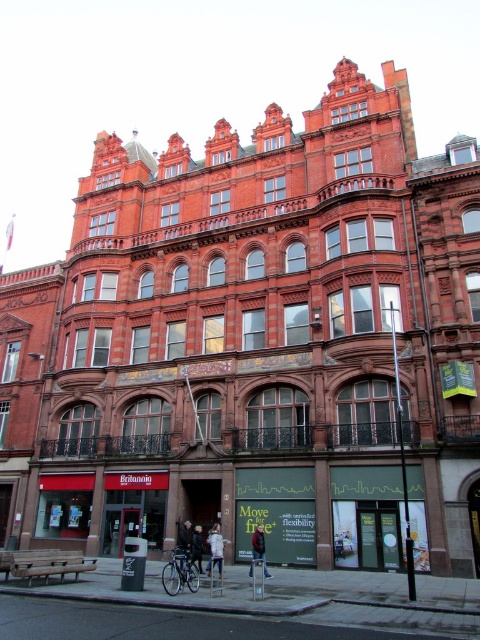
You are standing at the entrance of the Britannia building and want to park your shiny metallic bicycle at center. If the entrance is at coordinate point 0,0, and the building extends to 1.0 in all directions, where should you place your bicycle?

The shiny metallic bicycle at center should be placed at coordinate point (179, 573).

What is the 2D coordinate of the white cotton shirt at center in the image?

The white cotton shirt at center is located at the 2D coordinate point of (216, 548).

You are a delivery person who needs to park your shiny metallic bicycle at center and place your dark brown leather jacket at center near the entrance of the Britannia building. Given the space between the two objects, will the bicycle and jacket fit side by side without overlapping?

The shiny metallic bicycle at center is wider than the dark brown leather jacket at center. However, since both are placed at the center, they might overlap. To fit them side by side, ensure there is enough space between them based on their widths.